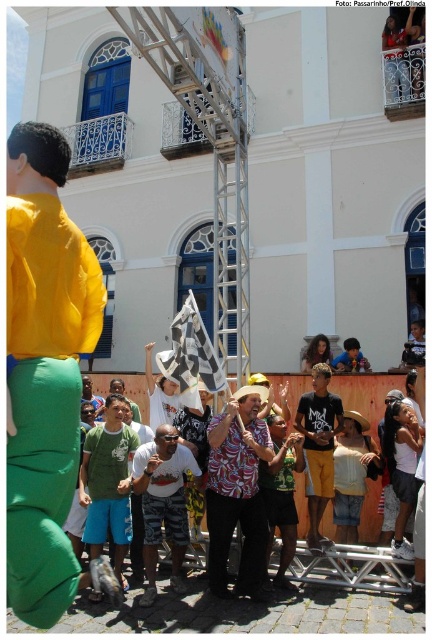
Is camouflage shorts at center below green fabric shirt at center?

Indeed, camouflage shorts at center is positioned under green fabric shirt at center.

Which is below, camouflage shorts at center or green fabric shirt at center?

camouflage shorts at center

What do you see at coordinates (164, 500) in the screenshot? The width and height of the screenshot is (432, 640). I see `camouflage shorts at center` at bounding box center [164, 500].

The width and height of the screenshot is (432, 640). I want to click on camouflage shorts at center, so click(x=164, y=500).

Can you confirm if matte yellow jacket at left is smaller than green fabric shirt at lower left?

Incorrect, matte yellow jacket at left is not smaller in size than green fabric shirt at lower left.

Based on the photo, does matte yellow jacket at left have a greater height compared to green fabric shirt at lower left?

Yes.

Between point (44, 140) and point (98, 408), which one is positioned in front?

Point (44, 140) is in front.

In order to click on matte yellow jacket at left in this screenshot , I will do `click(44, 371)`.

Image resolution: width=432 pixels, height=640 pixels. What do you see at coordinates (44, 371) in the screenshot? I see `matte yellow jacket at left` at bounding box center [44, 371].

Is the position of matte yellow jacket at left less distant than that of dark blue cotton shirt at center?

Yes, it is in front of dark blue cotton shirt at center.

Is point (50, 397) more distant than point (333, 428)?

No, (50, 397) is in front of (333, 428).

Identify the location of matte yellow jacket at left. (44, 371).